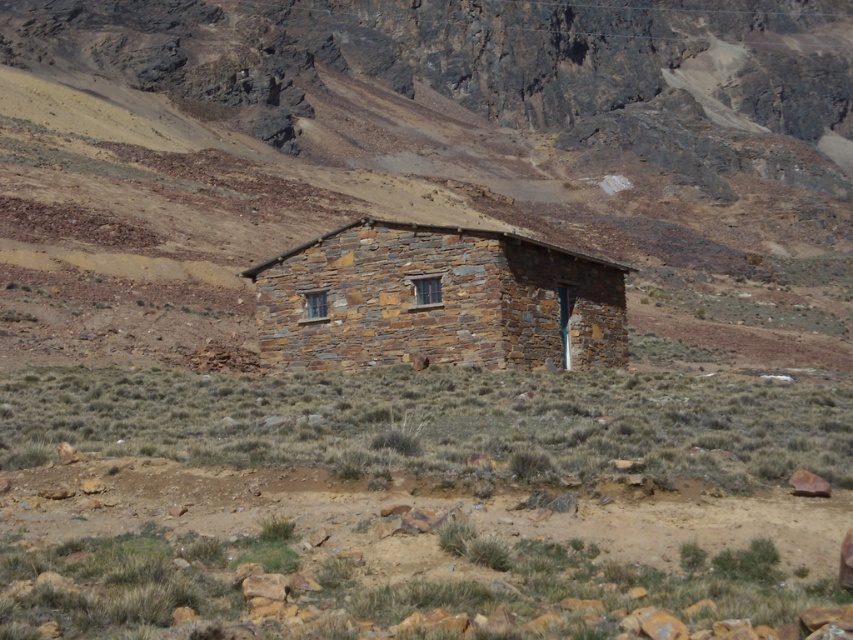
Question: Does brown rocky terrain at center have a lesser width compared to rustic stone hut at center?

Choices:
 (A) yes
 (B) no

Answer: (B)

Question: Can you confirm if brown rocky terrain at center is wider than rustic stone hut at center?

Choices:
 (A) yes
 (B) no

Answer: (A)

Question: Is the position of brown rocky terrain at center more distant than that of rustic stone hut at center?

Choices:
 (A) yes
 (B) no

Answer: (B)

Question: Which point is farther to the camera?

Choices:
 (A) rustic stone hut at center
 (B) brown rocky terrain at center

Answer: (A)

Question: Which of the following is the closest to the observer?

Choices:
 (A) brown rocky terrain at center
 (B) rustic stone hut at center

Answer: (A)

Question: Which object appears closest to the camera in this image?

Choices:
 (A) brown rocky terrain at center
 (B) rustic stone hut at center

Answer: (A)